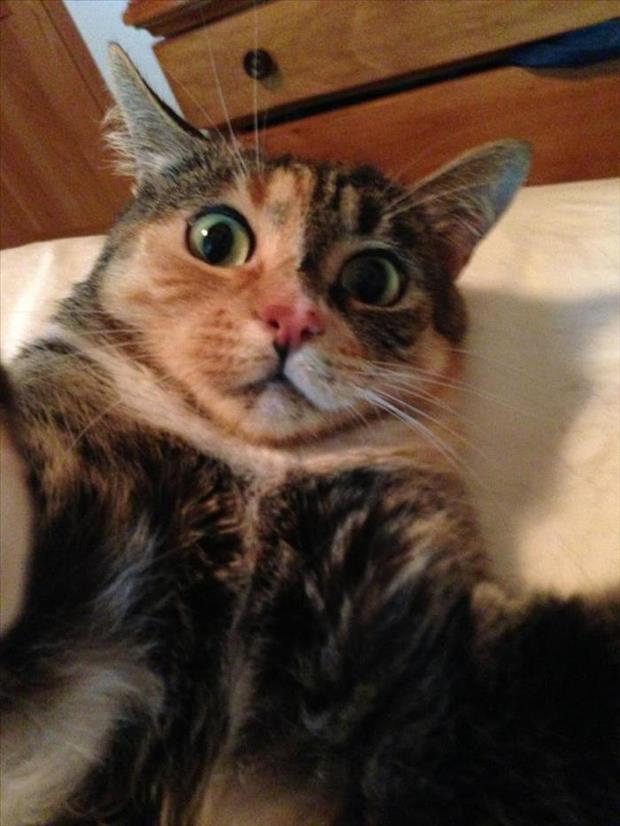
Where is `dresser`? This screenshot has width=620, height=826. dresser is located at coordinates (415, 22), (432, 108), (177, 7).